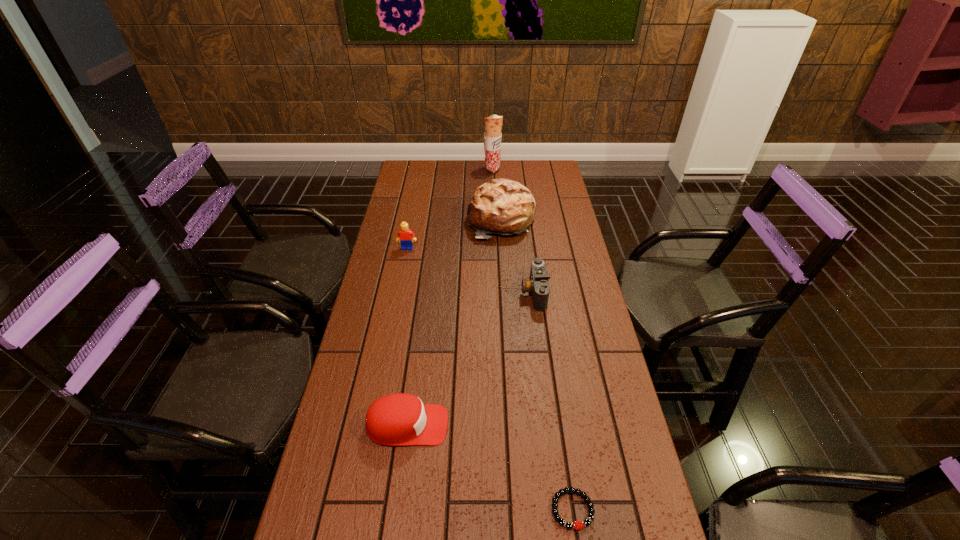
At what (x,y) coordinates should I click in order to perform the action: click on blank space that satisfies the following two spatial constraints: 1. on the front-facing side of the baseball cap; 2. on the left side of the nearest object. Please return your answer as a coordinate pair (x, y). This screenshot has width=960, height=540. Looking at the image, I should click on (396, 509).

Where is `free space that satisfies the following two spatial constraints: 1. on the face of the shortest object; 2. on the right side of the fourth nearest object`? This screenshot has width=960, height=540. free space that satisfies the following two spatial constraints: 1. on the face of the shortest object; 2. on the right side of the fourth nearest object is located at coordinates (356, 509).